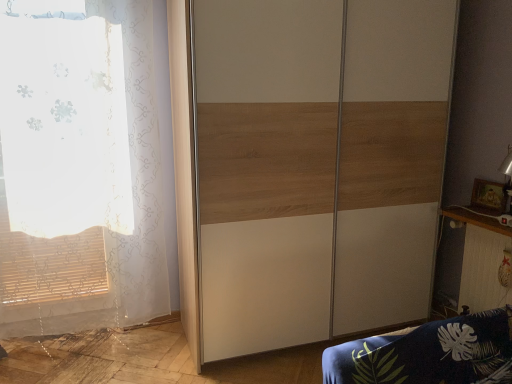
Question: From a real-world perspective, is white sheer curtain at left positioned above or below wooden/textured wardrobe at center?

Choices:
 (A) above
 (B) below

Answer: (B)

Question: Would you say white sheer curtain at left is to the left or to the right of wooden/textured wardrobe at center in the picture?

Choices:
 (A) right
 (B) left

Answer: (B)

Question: Estimate the real-world distances between objects in this image. Which object is closer to the wooden/textured wardrobe at center?

Choices:
 (A) wooden table at right
 (B) white sheer curtain at left

Answer: (A)

Question: Estimate the real-world distances between objects in this image. Which object is farther from the wooden table at right?

Choices:
 (A) white sheer curtain at left
 (B) wooden/textured wardrobe at center

Answer: (A)